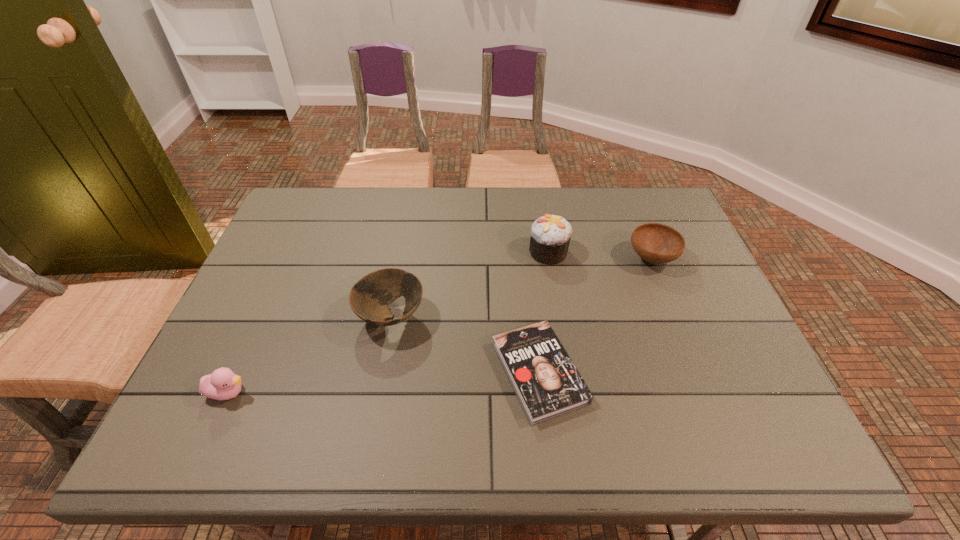
Identify the location of vacant point located 0.130m on the left of the shorter bowl. (581, 259).

Identify the location of vacant area situated on the back of the shortest object. Image resolution: width=960 pixels, height=540 pixels. (524, 239).

The width and height of the screenshot is (960, 540). What are the coordinates of `object that is at the near edge` in the screenshot? It's located at (547, 384).

Identify the location of object that is at the left edge. The width and height of the screenshot is (960, 540). (222, 384).

Identify the location of object that is at the right edge. The height and width of the screenshot is (540, 960). (656, 243).

Where is `vacant space at the far edge`? vacant space at the far edge is located at coordinates (360, 188).

What are the coordinates of `vacant space at the near edge of the desktop` in the screenshot? It's located at (613, 456).

Where is `free spot at the left edge of the desktop`? The width and height of the screenshot is (960, 540). free spot at the left edge of the desktop is located at coordinates (195, 407).

Where is `vacant space at the right edge of the desktop`? The image size is (960, 540). vacant space at the right edge of the desktop is located at coordinates (710, 377).

Locate an element on the screen. This screenshot has height=540, width=960. free spot at the far right corner of the desktop is located at coordinates (660, 202).